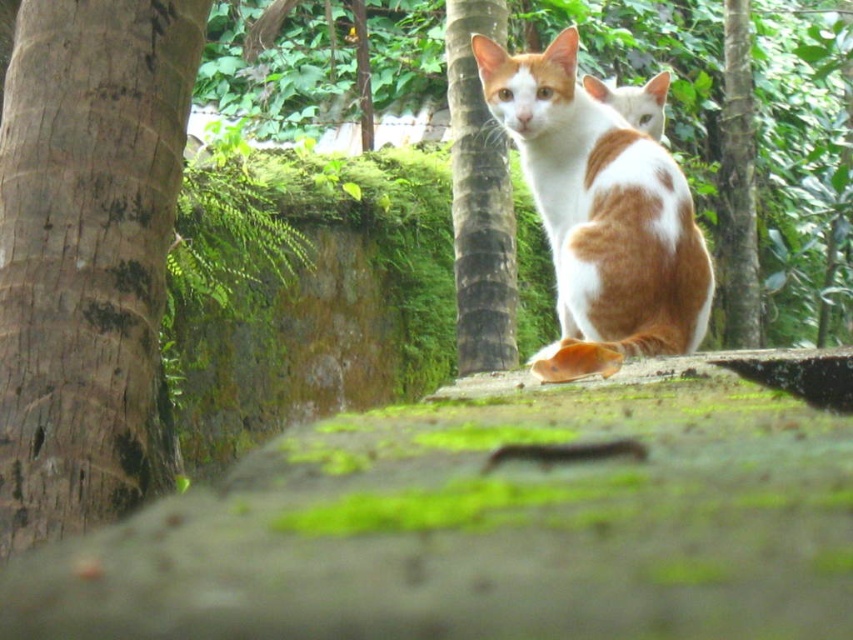
Question: Which object is farther from the camera taking this photo?

Choices:
 (A) orange and white fur cat at center
 (B) brown textured bark at left
 (C) orange-white fur cat at center

Answer: (A)

Question: Does brown textured bark at left have a lesser width compared to orange and white fur cat at center?

Choices:
 (A) yes
 (B) no

Answer: (B)

Question: Which point is farther to the camera?

Choices:
 (A) (82, 161)
 (B) (613, 99)
 (C) (650, 301)
 (D) (724, 332)

Answer: (D)

Question: Does brown textured tree trunk at center appear on the left side of green mossy tree trunk at center?

Choices:
 (A) yes
 (B) no

Answer: (A)

Question: Based on their relative distances, which object is farther from the brown textured tree trunk at center?

Choices:
 (A) brown textured bark at left
 (B) green mossy tree trunk at center
 (C) orange and white fur cat at center
 (D) orange-white fur cat at center

Answer: (B)

Question: Is orange-white fur cat at center smaller than brown textured tree trunk at center?

Choices:
 (A) no
 (B) yes

Answer: (A)